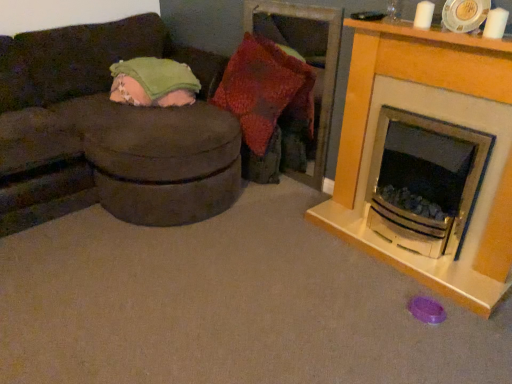
Question: Is suede-like brown studio couch at left shorter than knitted fabric pillow at center?

Choices:
 (A) no
 (B) yes

Answer: (A)

Question: Is suede-like brown studio couch at left behind knitted fabric pillow at center?

Choices:
 (A) yes
 (B) no

Answer: (B)

Question: Would you consider suede-like brown studio couch at left to be distant from knitted fabric pillow at center?

Choices:
 (A) no
 (B) yes

Answer: (A)

Question: Is suede-like brown studio couch at left next to knitted fabric pillow at center?

Choices:
 (A) no
 (B) yes

Answer: (A)

Question: From the image's perspective, would you say suede-like brown studio couch at left is positioned over knitted fabric pillow at center?

Choices:
 (A) no
 (B) yes

Answer: (A)

Question: Is suede-like brown studio couch at left in front of knitted fabric pillow at center?

Choices:
 (A) yes
 (B) no

Answer: (A)

Question: Is knitted fabric pillow at center wider than green soft blanket at upper left?

Choices:
 (A) yes
 (B) no

Answer: (B)

Question: Can you confirm if knitted fabric pillow at center is positioned to the left of green soft blanket at upper left?

Choices:
 (A) yes
 (B) no

Answer: (B)

Question: Is knitted fabric pillow at center smaller than green soft blanket at upper left?

Choices:
 (A) no
 (B) yes

Answer: (A)

Question: Is knitted fabric pillow at center turned away from green soft blanket at upper left?

Choices:
 (A) no
 (B) yes

Answer: (A)

Question: Is knitted fabric pillow at center in contact with green soft blanket at upper left?

Choices:
 (A) yes
 (B) no

Answer: (B)

Question: From the image's perspective, is knitted fabric pillow at center on green soft blanket at upper left?

Choices:
 (A) yes
 (B) no

Answer: (B)

Question: Is white glossy fireplace at right touching knitted fabric pillow at center?

Choices:
 (A) yes
 (B) no

Answer: (B)